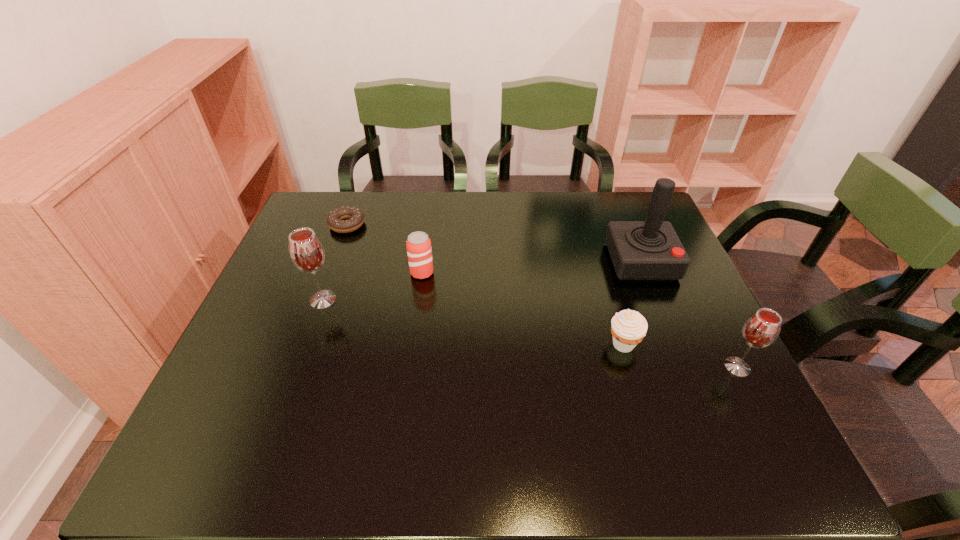
Locate an element on the screen. This screenshot has width=960, height=540. object that is positioned at the far left corner is located at coordinates (335, 220).

Where is `free space at the far edge`? The width and height of the screenshot is (960, 540). free space at the far edge is located at coordinates (505, 233).

In order to click on free space at the near edge in this screenshot , I will do `click(606, 393)`.

Identify the location of vacant space at the far left corner of the desktop. (354, 195).

At what (x,y) coordinates should I click in order to perform the action: click on free space between the right wineglass and the muffin. Please return your answer as a coordinate pair (x, y). The image size is (960, 540). Looking at the image, I should click on [x=680, y=355].

Where is `vacant point located between the muffin and the right wineglass`? The width and height of the screenshot is (960, 540). vacant point located between the muffin and the right wineglass is located at coordinates (680, 355).

At what (x,y) coordinates should I click in order to perform the action: click on vacant space in between the third object from left to right and the shortest object. Please return your answer as a coordinate pair (x, y). Image resolution: width=960 pixels, height=540 pixels. Looking at the image, I should click on (385, 249).

This screenshot has width=960, height=540. Identify the location of free area in between the shortest object and the farther wineglass. pyautogui.click(x=335, y=262).

Find the location of a particular element. This screenshot has width=960, height=540. free spot between the fourth object from right to left and the shortest object is located at coordinates coord(385,249).

Locate an element on the screen. This screenshot has height=540, width=960. free point between the tallest object and the nearer wineglass is located at coordinates (689, 314).